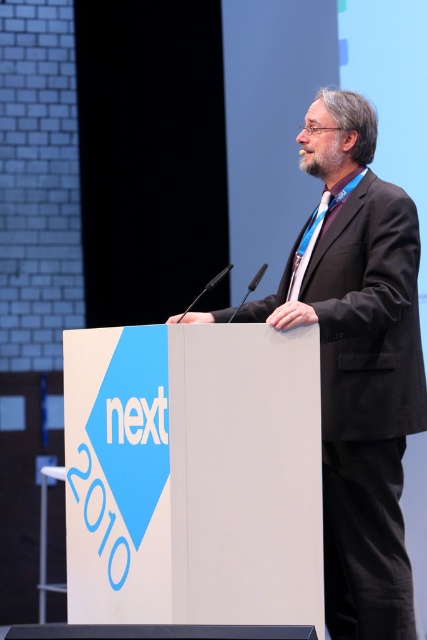
Can you confirm if black suit at center is positioned to the right of blue silk tie at center?

Incorrect, black suit at center is not on the right side of blue silk tie at center.

Image resolution: width=427 pixels, height=640 pixels. Find the location of `black suit at center`. black suit at center is located at coordinates (359, 365).

This screenshot has width=427, height=640. What do you see at coordinates (359, 365) in the screenshot?
I see `black suit at center` at bounding box center [359, 365].

In order to click on black suit at center in this screenshot , I will do `click(359, 365)`.